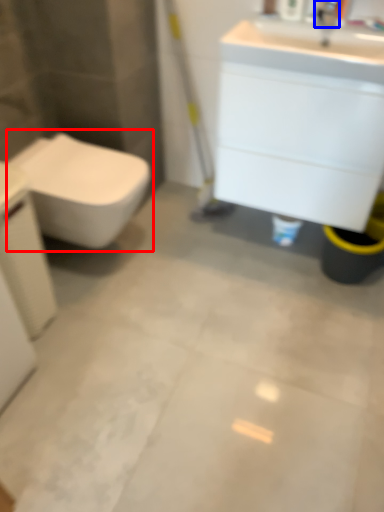
Question: Which point is further to the camera, toilet (highlighted by a red box) or faucet (highlighted by a blue box)?

Choices:
 (A) toilet
 (B) faucet

Answer: (A)